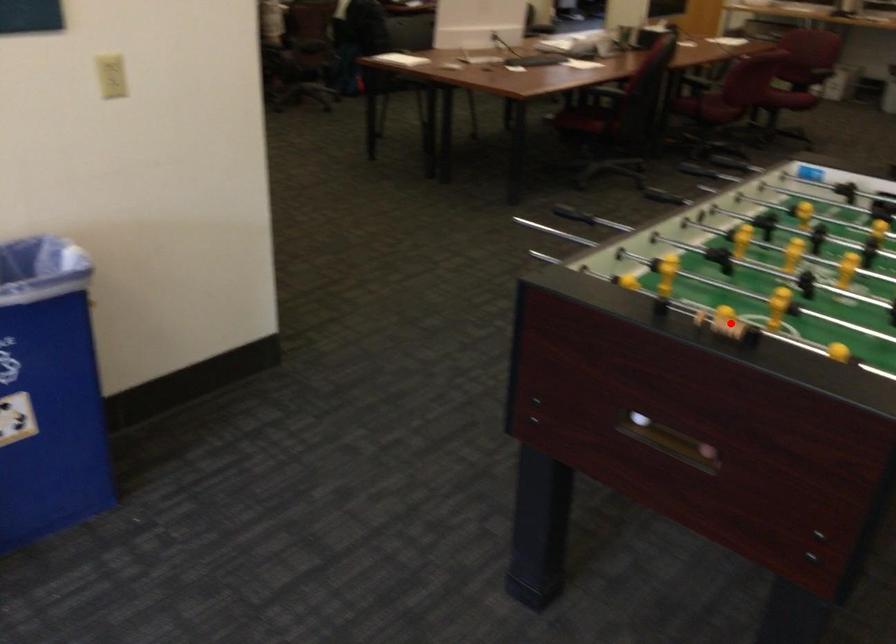
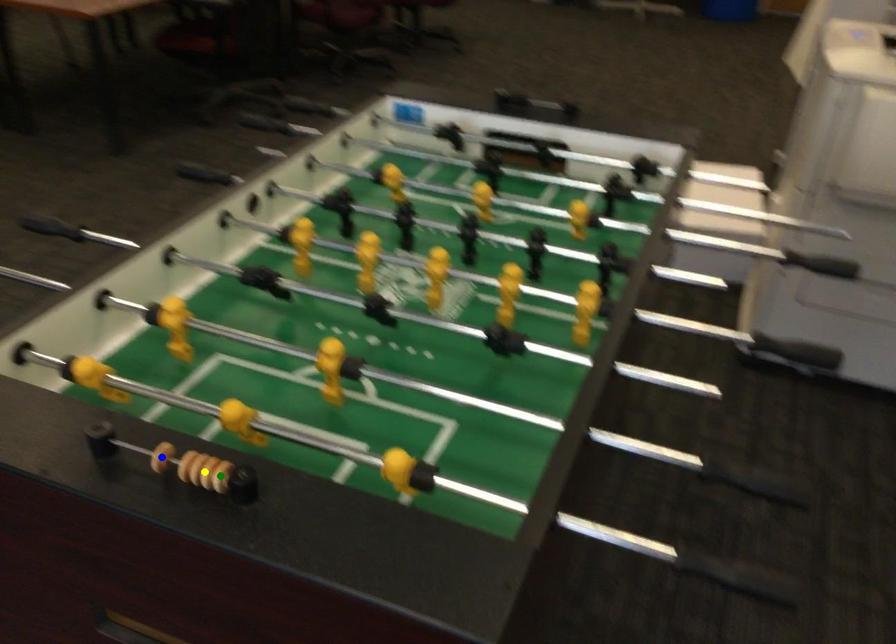
Question: I am providing you with two images of the same scene from different viewpoints. A red point is marked on the first image. You are given multiple points on the second image. Which mark in image 2 goes with the point in image 1?

Choices:
 (A) yellow point
 (B) green point
 (C) blue point

Answer: (A)